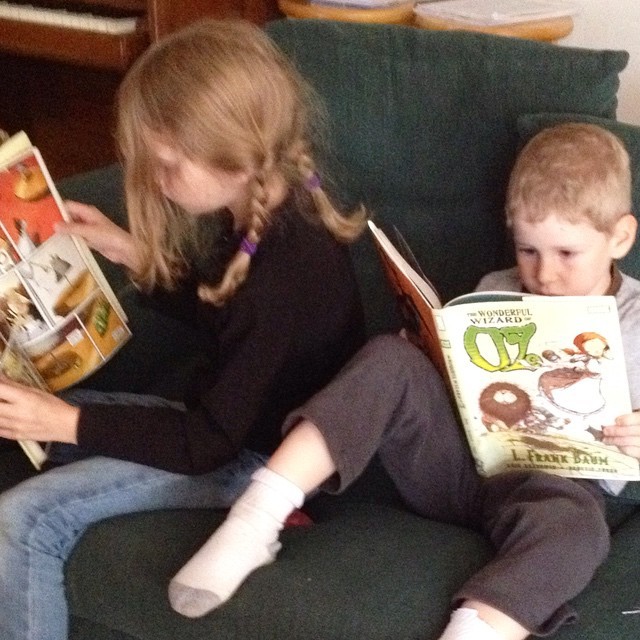
You are a GUI agent. You are given a task and a screenshot of the screen. Output one action in this format:
    pyautogui.click(x=<x>, y=<y>)
    Task: Click on the piano
    The image size is (640, 640).
    Given the screenshot: What is the action you would take?
    pyautogui.click(x=83, y=32)